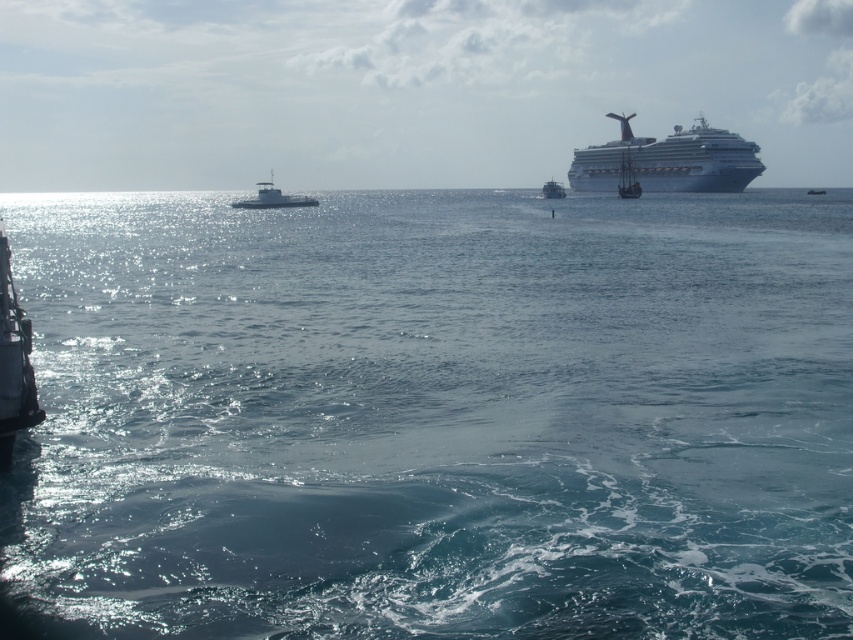
Question: Among these objects, which one is farthest from the camera?

Choices:
 (A) metallic gray boat at center
 (B) white glossy cruise ship at upper right

Answer: (A)

Question: Among these points, which one is farthest from the camera?

Choices:
 (A) (560, 182)
 (B) (457, 608)

Answer: (A)

Question: Is white glossy sailboat at center positioned behind metallic gray boat at center?

Choices:
 (A) no
 (B) yes

Answer: (A)

Question: Can you confirm if blue water at center is positioned above white glossy sailboat at center?

Choices:
 (A) no
 (B) yes

Answer: (A)

Question: Based on their relative distances, which object is nearer to the white glossy sailboat at center?

Choices:
 (A) metallic gray boat at center
 (B) white glossy boat at center
 (C) white glossy cruise ship at upper right
 (D) blue water at center

Answer: (C)

Question: Is white glossy boat at center to the left of white glossy sailboat at center from the viewer's perspective?

Choices:
 (A) no
 (B) yes

Answer: (B)